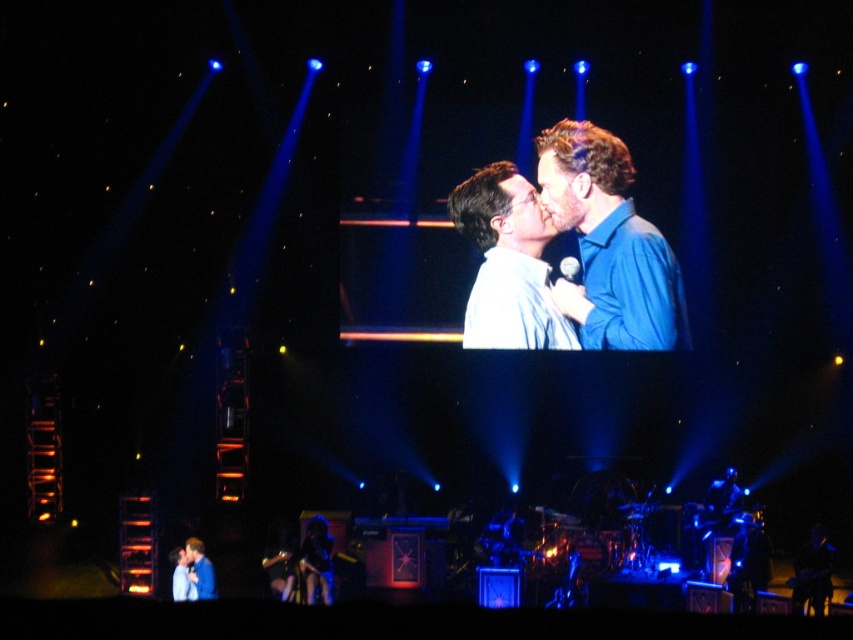
Question: Is blue shirt at center above shiny black dress at lower center?

Choices:
 (A) no
 (B) yes

Answer: (B)

Question: Is blue shirt at center positioned behind white glossy shirt at center?

Choices:
 (A) yes
 (B) no

Answer: (B)

Question: Among these points, which one is nearest to the camera?

Choices:
 (A) [492, 316]
 (B) [547, 132]
 (C) [323, 579]

Answer: (C)

Question: Which object is closer to the camera taking this photo?

Choices:
 (A) white glossy shirt at center
 (B) blue shirt at center
 (C) blue shirt at lower left
 (D) shiny black dress at lower center

Answer: (C)

Question: Is shiny black dress at lower center further to the viewer compared to blue shirt at lower left?

Choices:
 (A) no
 (B) yes

Answer: (B)

Question: Estimate the real-world distances between objects in this image. Which object is closer to the shiny black dress at lower center?

Choices:
 (A) blue shirt at center
 (B) blue shirt at lower left

Answer: (B)